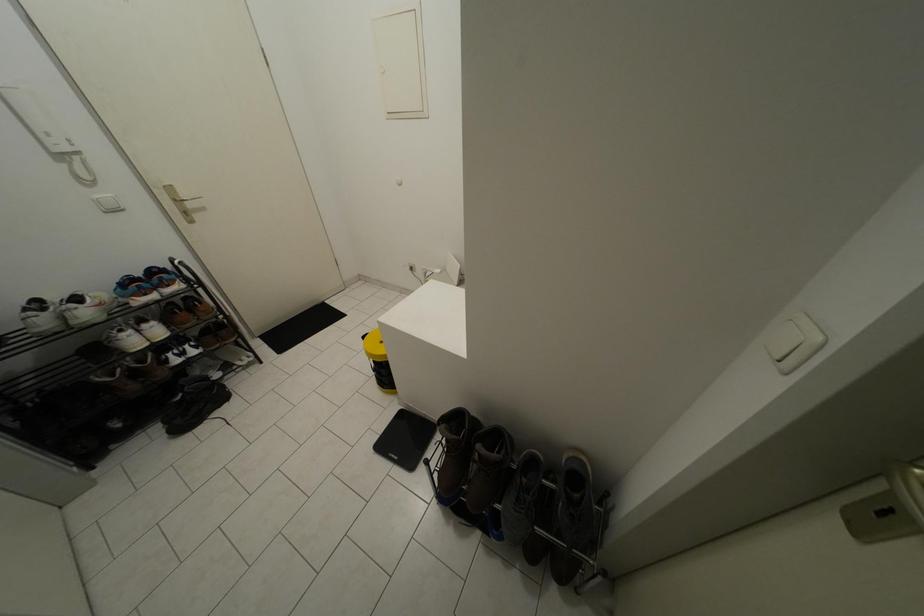
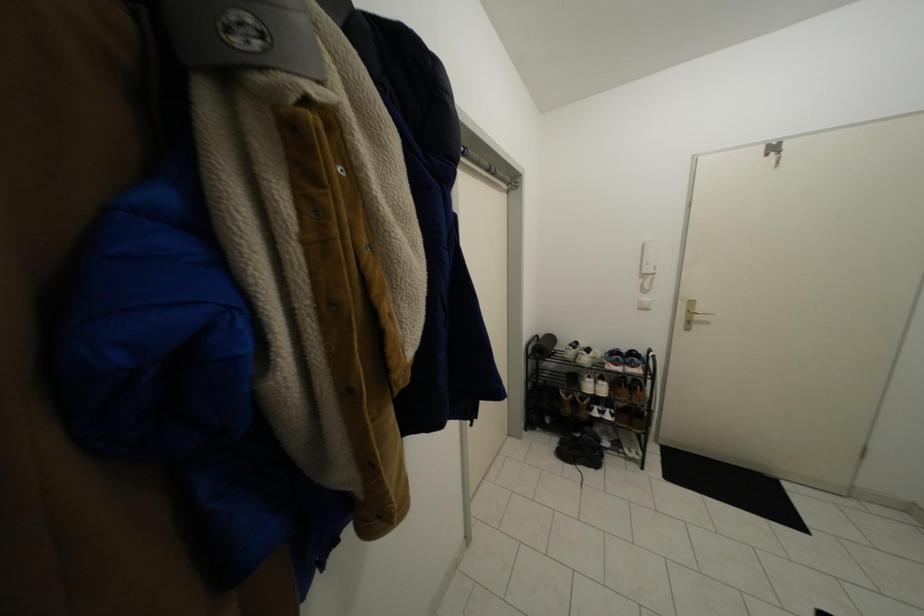
Question: The camera is either moving clockwise (left) or counter-clockwise (right) around the object. The first image is from the beginning of the video and the second image is from the end. Is the camera moving left or right when shooting the video?

Choices:
 (A) Left
 (B) Right

Answer: (B)